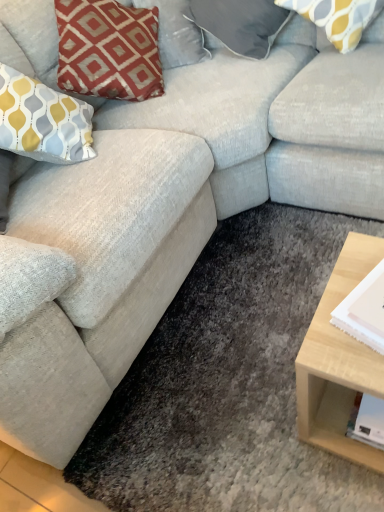
Question: Considering the relative positions of satin gray pillow at upper center, arranged as the 1th pillow when viewed from the left, and yellow and gray patterned pillow at upper right, positioned as the 2th pillow in left-to-right order, in the image provided, is satin gray pillow at upper center, arranged as the 1th pillow when viewed from the left, to the left of yellow and gray patterned pillow at upper right, positioned as the 2th pillow in left-to-right order, from the viewer's perspective?

Choices:
 (A) yes
 (B) no

Answer: (A)

Question: Is satin gray pillow at upper center, arranged as the 1th pillow when viewed from the left, closer to the viewer compared to yellow and gray patterned pillow at upper right, positioned as the 2th pillow in left-to-right order?

Choices:
 (A) no
 (B) yes

Answer: (A)

Question: From the image's perspective, is satin gray pillow at upper center, arranged as the 1th pillow when viewed from the left, on top of yellow and gray patterned pillow at upper right, which appears as the first pillow when viewed from the right?

Choices:
 (A) no
 (B) yes

Answer: (B)

Question: Is satin gray pillow at upper center, which appears as the 2th pillow when viewed from the right, bigger than yellow and gray patterned pillow at upper right, positioned as the 2th pillow in left-to-right order?

Choices:
 (A) no
 (B) yes

Answer: (B)

Question: Is satin gray pillow at upper center, arranged as the 1th pillow when viewed from the left, facing towards yellow and gray patterned pillow at upper right, which appears as the first pillow when viewed from the right?

Choices:
 (A) no
 (B) yes

Answer: (A)

Question: Considering the positions of point (233, 49) and point (337, 31), is point (233, 49) closer or farther from the camera than point (337, 31)?

Choices:
 (A) closer
 (B) farther

Answer: (B)

Question: Considering their positions, is satin gray pillow at upper center, arranged as the 1th pillow when viewed from the left, located in front of or behind yellow and gray patterned pillow at upper right, positioned as the 2th pillow in left-to-right order?

Choices:
 (A) behind
 (B) front

Answer: (A)

Question: From a real-world perspective, relative to yellow and gray patterned pillow at upper right, positioned as the 2th pillow in left-to-right order, is satin gray pillow at upper center, arranged as the 1th pillow when viewed from the left, vertically above or below?

Choices:
 (A) above
 (B) below

Answer: (B)

Question: From the image's perspective, relative to yellow and gray patterned pillow at upper right, positioned as the 2th pillow in left-to-right order, is satin gray pillow at upper center, arranged as the 1th pillow when viewed from the left, above or below?

Choices:
 (A) below
 (B) above

Answer: (B)

Question: From a real-world perspective, is white paper at right positioned above or below yellow and gray patterned pillow at upper right, which appears as the first pillow when viewed from the right?

Choices:
 (A) above
 (B) below

Answer: (B)

Question: Does point (339, 308) appear closer or farther from the camera than point (326, 1)?

Choices:
 (A) closer
 (B) farther

Answer: (A)

Question: Is white paper at right wider or thinner than yellow and gray patterned pillow at upper right, which appears as the first pillow when viewed from the right?

Choices:
 (A) wide
 (B) thin

Answer: (B)

Question: Considering their positions, is white paper at right located in front of or behind yellow and gray patterned pillow at upper right, positioned as the 2th pillow in left-to-right order?

Choices:
 (A) front
 (B) behind

Answer: (A)

Question: Does point click(x=360, y=288) appear closer or farther from the camera than point click(x=236, y=37)?

Choices:
 (A) farther
 (B) closer

Answer: (B)

Question: Relative to satin gray pillow at upper center, which appears as the 2th pillow when viewed from the right, is white paper at right in front or behind?

Choices:
 (A) behind
 (B) front

Answer: (B)